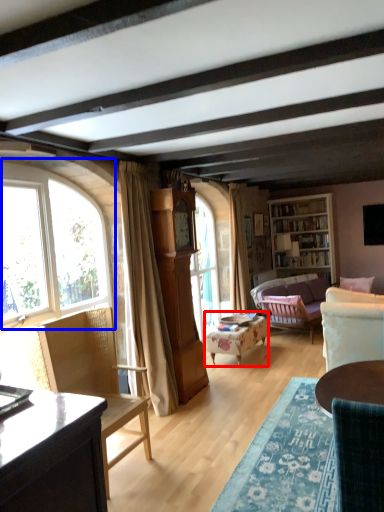
Question: Among these objects, which one is nearest to the camera, chair (highlighted by a red box) or window (highlighted by a blue box)?

Choices:
 (A) chair
 (B) window

Answer: (B)